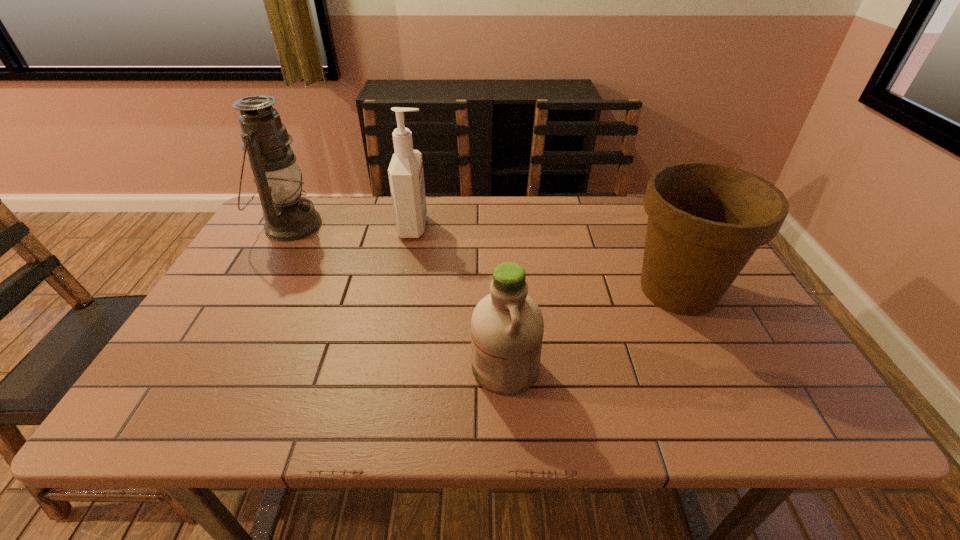
Image resolution: width=960 pixels, height=540 pixels. I want to click on vacant space located 0.140m on the front label of the shorter cleansing agent, so click(x=406, y=368).

At what (x,y) coordinates should I click in order to perform the action: click on free space located 0.140m on the front label of the shorter cleansing agent. Please return your answer as a coordinate pair (x, y). The image size is (960, 540). Looking at the image, I should click on (406, 368).

You are a GUI agent. You are given a task and a screenshot of the screen. Output one action in this format:
    pyautogui.click(x=<x>, y=<y>)
    Task: Click on the free spot located on the front label of the shorter cleansing agent
    The image size is (960, 540).
    Given the screenshot: What is the action you would take?
    pyautogui.click(x=298, y=368)

The image size is (960, 540). In order to click on oil lamp present at the far edge in this screenshot , I will do `click(288, 217)`.

In order to click on cleansing agent located at the far edge in this screenshot , I will do `click(406, 177)`.

You are a GUI agent. You are given a task and a screenshot of the screen. Output one action in this format:
    pyautogui.click(x=<x>, y=<y>)
    Task: Click on the object positioned at the near edge
    
    Given the screenshot: What is the action you would take?
    (x=507, y=326)

The height and width of the screenshot is (540, 960). What are the coordinates of `object located at the left edge` in the screenshot? It's located at (288, 217).

You are a GUI agent. You are given a task and a screenshot of the screen. Output one action in this format:
    pyautogui.click(x=<x>, y=<y>)
    Task: Click on the object present at the right edge
    The width and height of the screenshot is (960, 540).
    Given the screenshot: What is the action you would take?
    pyautogui.click(x=705, y=220)

Identify the location of object at the far left corner. (288, 217).

The height and width of the screenshot is (540, 960). Identify the location of free region at the far edge. (346, 224).